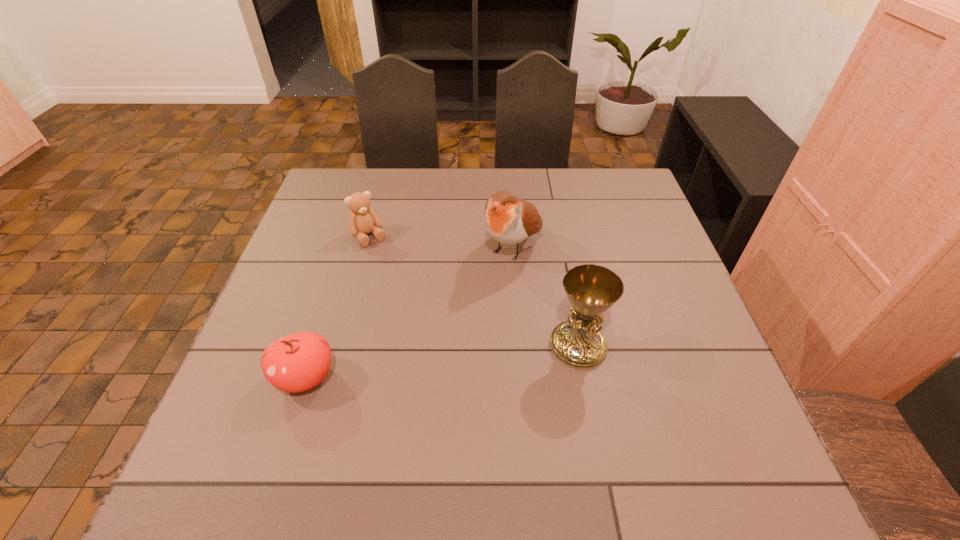
Locate an element on the screen. apple is located at coordinates (298, 362).

Image resolution: width=960 pixels, height=540 pixels. I want to click on chalice, so click(x=591, y=289).

I want to click on teddy bear, so coord(363,220).

Where is `bird`? This screenshot has width=960, height=540. bird is located at coordinates (508, 219).

Where is `vacant space located on the back of the apple`? vacant space located on the back of the apple is located at coordinates (344, 259).

Where is `vacant area located 0.050m on the back of the chalice`? This screenshot has width=960, height=540. vacant area located 0.050m on the back of the chalice is located at coordinates (570, 307).

This screenshot has height=540, width=960. I want to click on free space located 0.360m on the front-facing side of the teddy bear, so click(x=437, y=339).

Image resolution: width=960 pixels, height=540 pixels. What are the coordinates of `free region located on the front-facing side of the teddy bear` in the screenshot? It's located at (418, 309).

At what (x,y) coordinates should I click in order to perform the action: click on vacant region located on the front-facing side of the teddy bear. Please return your answer as a coordinate pair (x, y). This screenshot has height=540, width=960. Looking at the image, I should click on (405, 291).

You are a GUI agent. You are given a task and a screenshot of the screen. Output one action in this format:
    pyautogui.click(x=<x>, y=<y>)
    Task: Click on the free space located 0.400m at the face of the bird
    
    Given the screenshot: What is the action you would take?
    pyautogui.click(x=406, y=394)